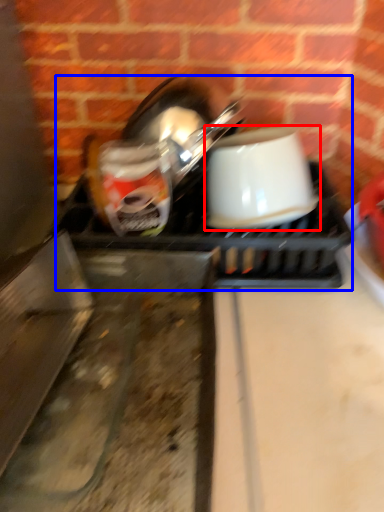
Question: Which object appears closest to the camera in this image, coffee cup (highlighted by a red box) or appliance (highlighted by a blue box)?

Choices:
 (A) coffee cup
 (B) appliance

Answer: (A)